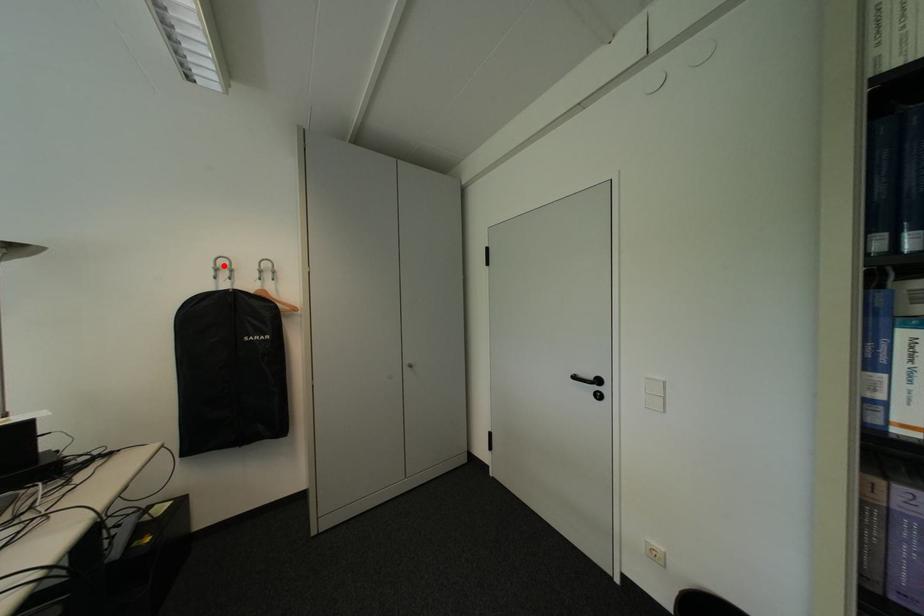
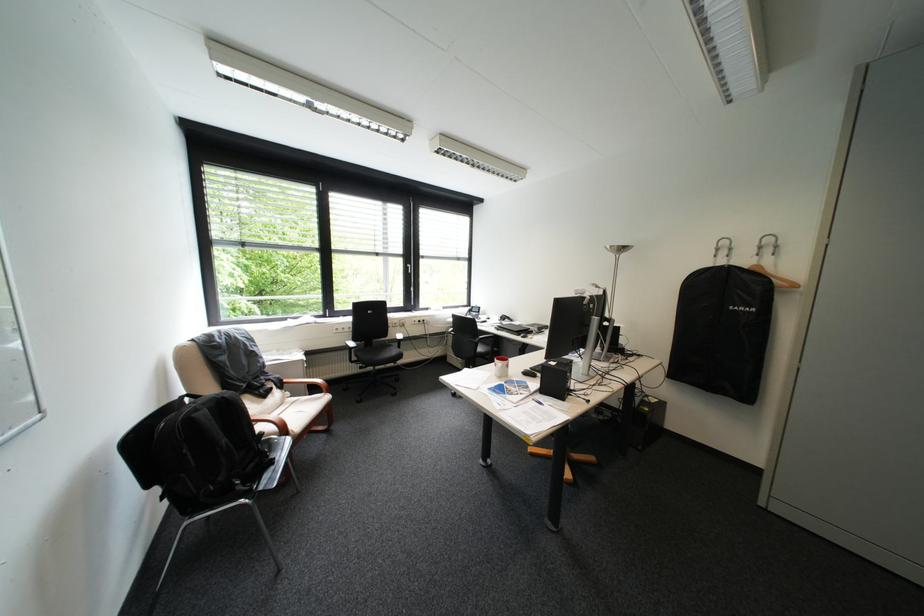
Locate, in the second image, the point that corresponds to the highlighted location in the first image.

(727, 246)